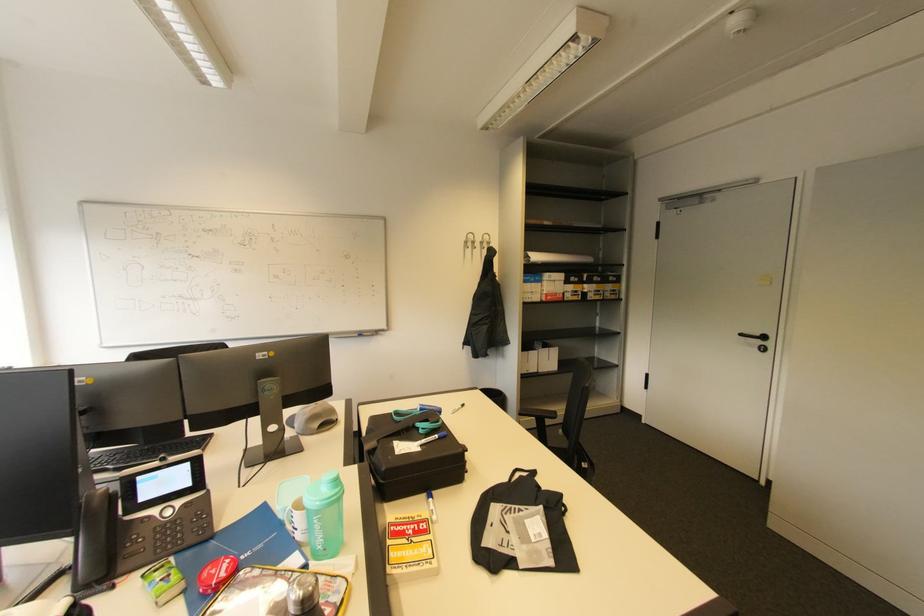
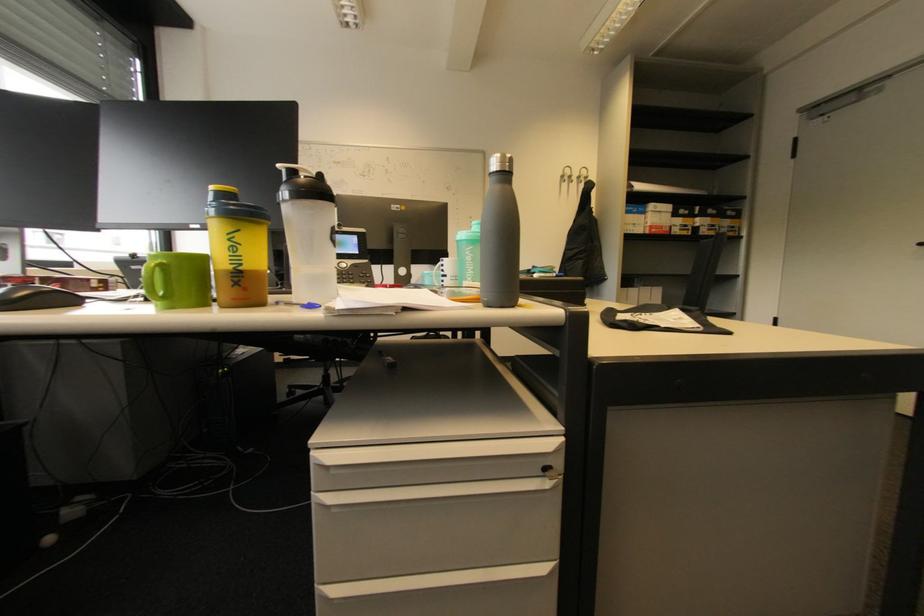
Question: The camera is either moving clockwise (left) or counter-clockwise (right) around the object. The first image is from the beginning of the video and the second image is from the end. Is the camera moving left or right when shooting the video?

Choices:
 (A) Left
 (B) Right

Answer: (B)